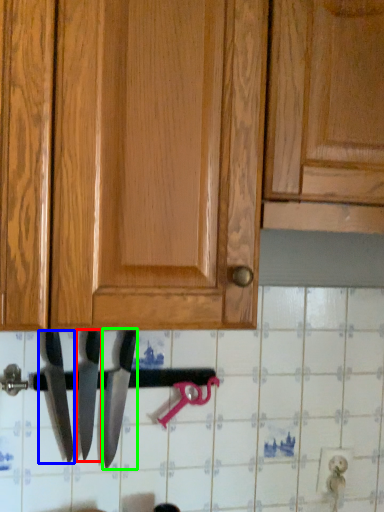
Question: Based on their relative distances, which object is nearer to knife (highlighted by a red box)? Choose from knife (highlighted by a blue box) and knife (highlighted by a green box).

Choices:
 (A) knife
 (B) knife

Answer: (B)